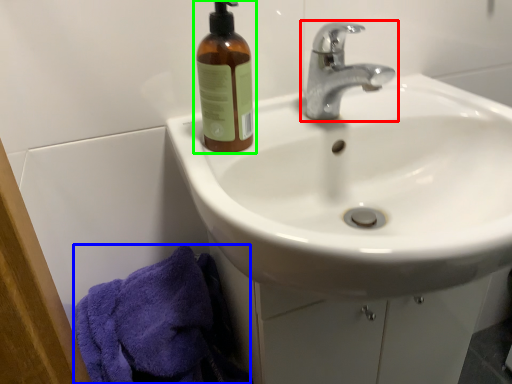
Question: Estimate the real-world distances between objects in this image. Which object is closer to tap (highlighted by a red box), bath towel (highlighted by a blue box) or bottle (highlighted by a green box)?

Choices:
 (A) bath towel
 (B) bottle

Answer: (B)